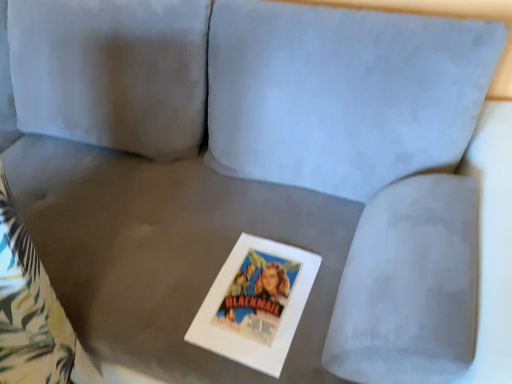
Locate an element on the screen. This screenshot has width=512, height=384. free space above matte white paperback book at center (from a real-world perspective) is located at coordinates (259, 280).